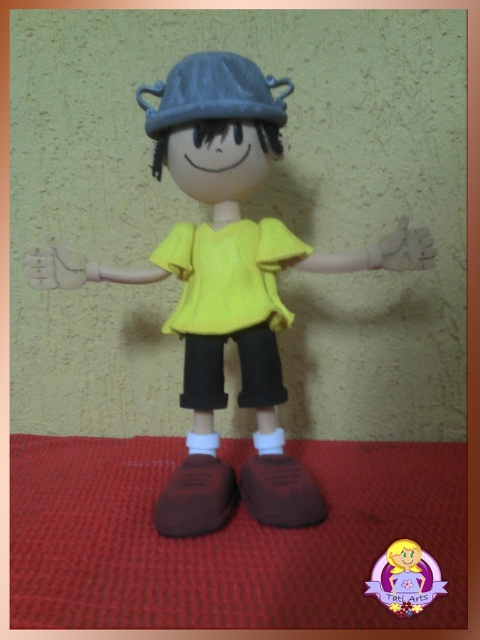
You are an interior designer assessing the placement of two hands in a room. The scene includes a handmade clay figurine against a beige wall with a red textured surface below. You need to determine if the matte plastic hand at left is taller than the matte brown hand at center. Can you confirm this based on the provided information?

The matte plastic hand at left has a greater height compared to the matte brown hand at center, so yes, the matte plastic hand at left is taller than the matte brown hand at center.

You are an artist observing the handmade clay figurine. You notice the matte gray baseball hat at upper center and the matte brown hand at center. Which object is positioned closer to you?

The matte gray baseball hat at upper center is closer to the viewer than the matte brown hand at center.

You are an artist observing the handmade clay figurine. You notice the matte gray baseball hat at upper center and the matte brown hand at center. Which object is positioned higher in the image?

The matte gray baseball hat at upper center is positioned higher than the matte brown hand at center.